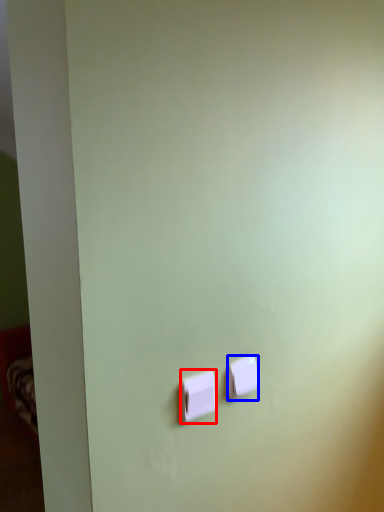
Question: Which object appears farthest to the camera in this image, light switch (highlighted by a red box) or light switch (highlighted by a blue box)?

Choices:
 (A) light switch
 (B) light switch

Answer: (B)